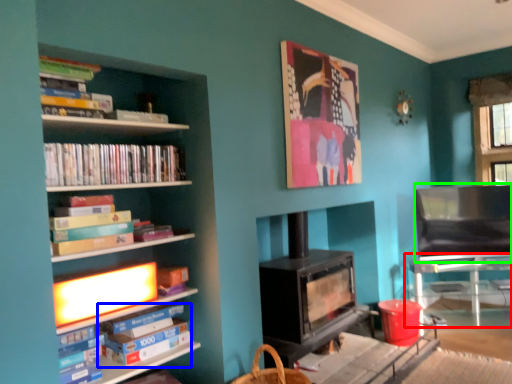
Question: Estimate the real-world distances between objects in this image. Which object is farther from table (highlighted by a red box), paperback book (highlighted by a blue box) or armchair (highlighted by a green box)?

Choices:
 (A) paperback book
 (B) armchair

Answer: (A)